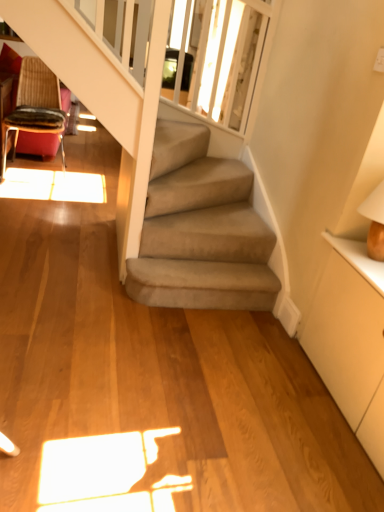
Question: Looking at their shapes, would you say translucent glass window screen at upper center is wider or thinner than wooden textured chair at upper left?

Choices:
 (A) thin
 (B) wide

Answer: (A)

Question: Would you say translucent glass window screen at upper center is inside or outside wooden textured chair at upper left?

Choices:
 (A) inside
 (B) outside

Answer: (B)

Question: Which object is positioned closest to the white matte dresser at right?

Choices:
 (A) translucent glass window screen at upper center
 (B) wooden textured chair at upper left

Answer: (A)

Question: Which of these objects is positioned closest to the wooden textured chair at upper left?

Choices:
 (A) translucent glass window screen at upper center
 (B) white matte dresser at right

Answer: (A)